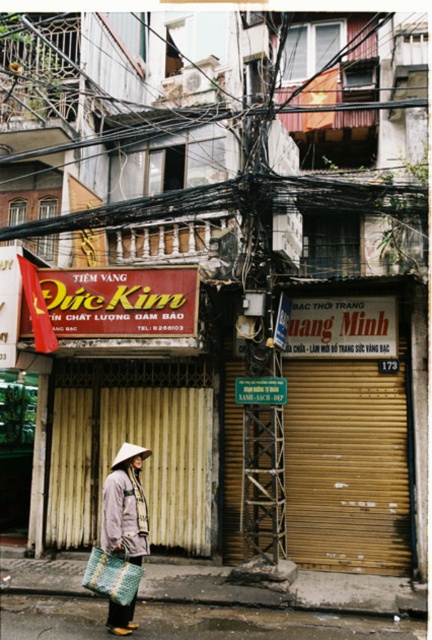
Question: Does matte fabric bag at lower center have a smaller size compared to light gray woven hat at lower left?

Choices:
 (A) no
 (B) yes

Answer: (A)

Question: Based on their relative distances, which object is farther from the light gray woven hat at lower left?

Choices:
 (A) matte fabric bag at lower center
 (B) gray textured coat at center

Answer: (A)

Question: Among these points, which one is farthest from the camera?

Choices:
 (A) (301, 592)
 (B) (143, 454)

Answer: (A)

Question: From the image, what is the correct spatial relationship of light gray woven hat at lower left in relation to gray textured coat at center?

Choices:
 (A) right
 (B) left

Answer: (A)

Question: Considering the real-world distances, which object is closest to the light gray woven hat at lower left?

Choices:
 (A) gray textured coat at center
 (B) matte fabric bag at lower center

Answer: (A)

Question: Can you confirm if light gray woven hat at lower left is thinner than gray textured coat at center?

Choices:
 (A) yes
 (B) no

Answer: (A)